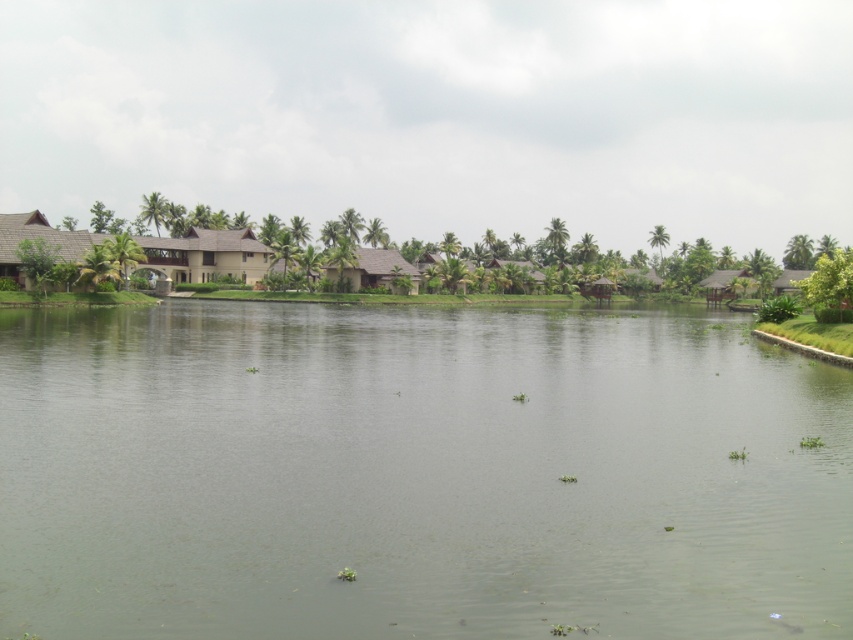
You are a visitor at the lakeside resort and want to take a photo of the brown thatched hut at center without the green water at center appearing in the background. Is this possible given their positions?

The green water at center is in front of the brown thatched hut at center, so the water would block the view of the hut. Therefore, it is not possible to take a photo of the brown thatched hut at center without the green water at center in the background.

You are standing at the edge of the lakeside and want to reach the green water at center. According to the coordinates provided, in which direction should you move relative to your current position?

The green water at center is located at coordinates point [416,474]. Since you are at the edge, you should move towards the center of the image to reach it.

You are planning to build a small boat dock on the lakeside. The dock needs to be as wide as the brown thatched hut at center. Based on the scene, can the green water at center accommodate the dock in terms of width?

The green water at center might be wider than brown thatched hut at center, so it could potentially accommodate the dock. However, since the exact width isn not specified, further measurements are recommended to confirm.